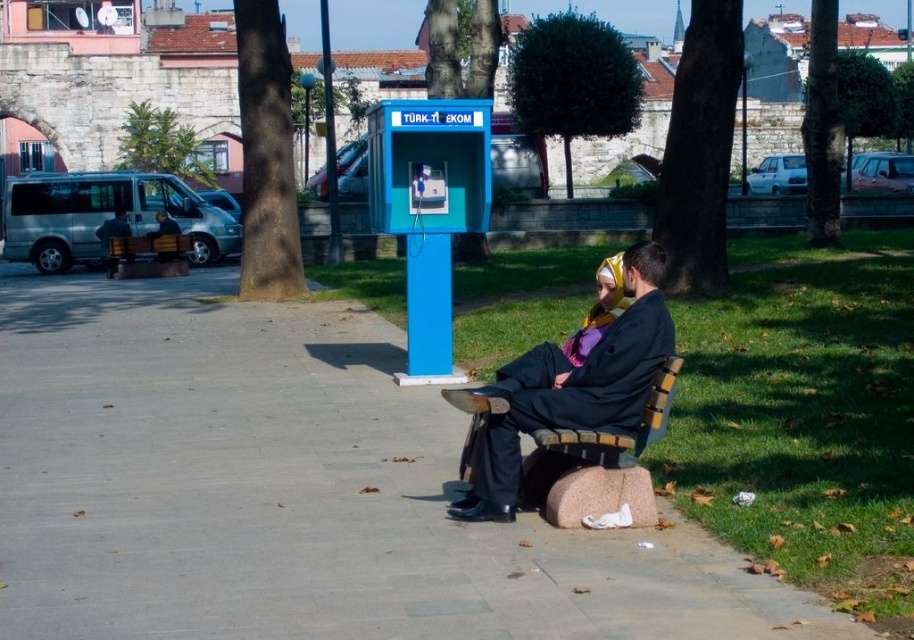
Locate an element on the screen. The width and height of the screenshot is (914, 640). wooden bench at center is located at coordinates (149, 256).

Which is more to the right, wooden bench at center or dark blue suit at left?

From the viewer's perspective, wooden bench at center appears more on the right side.

You are a GUI agent. You are given a task and a screenshot of the screen. Output one action in this format:
    pyautogui.click(x=<x>, y=<y>)
    Task: Click on the wooden bench at center
    
    Given the screenshot: What is the action you would take?
    pyautogui.click(x=149, y=256)

The height and width of the screenshot is (640, 914). I want to click on wooden bench at center, so click(149, 256).

Does point (594, 404) come closer to viewer compared to point (176, 257)?

Yes, it is.

Is point (587, 406) positioned behind point (167, 218)?

No, it is in front of (167, 218).

The width and height of the screenshot is (914, 640). What are the coordinates of `black matte robe at center` in the screenshot? It's located at (571, 397).

Between black matte robe at center and dark blue suit at center, which one has more height?

dark blue suit at center is taller.

Which is behind, point (555, 417) or point (114, 257)?

The point (114, 257) is more distant.

In order to click on black matte robe at center in this screenshot , I will do `click(571, 397)`.

Locate an element on the screen. The width and height of the screenshot is (914, 640). black matte robe at center is located at coordinates (571, 397).